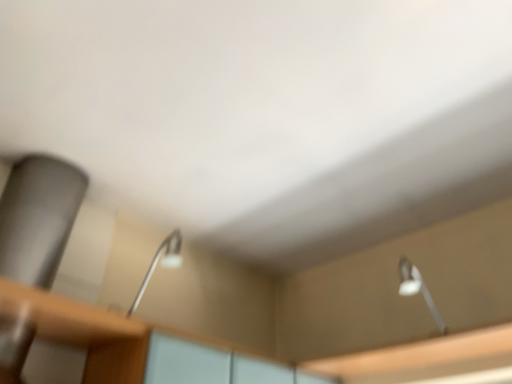
Question: Is the surface of white glossy lamp at upper right, arranged as the first lamp when viewed from the right, in direct contact with wooden table at lower left?

Choices:
 (A) yes
 (B) no

Answer: (B)

Question: Is white glossy lamp at upper right, positioned as the second lamp in left-to-right order, not inside wooden table at lower left?

Choices:
 (A) yes
 (B) no

Answer: (A)

Question: Does white glossy lamp at upper right, arranged as the first lamp when viewed from the right, have a greater height compared to wooden table at lower left?

Choices:
 (A) no
 (B) yes

Answer: (B)

Question: From the image's perspective, does white glossy lamp at upper right, arranged as the first lamp when viewed from the right, appear higher than wooden table at lower left?

Choices:
 (A) no
 (B) yes

Answer: (B)

Question: Considering the relative sizes of white glossy lamp at upper right, positioned as the second lamp in left-to-right order, and wooden table at lower left in the image provided, is white glossy lamp at upper right, positioned as the second lamp in left-to-right order, shorter than wooden table at lower left?

Choices:
 (A) yes
 (B) no

Answer: (B)

Question: In terms of height, does wooden table at lower left look taller or shorter compared to metallic silver lamp at center, which is counted as the 1th lamp, starting from the left?

Choices:
 (A) short
 (B) tall

Answer: (A)

Question: Is point (61, 334) positioned closer to the camera than point (152, 261)?

Choices:
 (A) closer
 (B) farther

Answer: (A)

Question: From the image's perspective, is wooden table at lower left positioned above or below metallic silver lamp at center, positioned as the 2th lamp in right-to-left order?

Choices:
 (A) above
 (B) below

Answer: (B)

Question: Is wooden table at lower left bigger or smaller than metallic silver lamp at center, which is counted as the 1th lamp, starting from the left?

Choices:
 (A) big
 (B) small

Answer: (A)

Question: In terms of width, does metallic silver lamp at center, positioned as the 2th lamp in right-to-left order, look wider or thinner when compared to white glossy lamp at upper right, positioned as the second lamp in left-to-right order?

Choices:
 (A) wide
 (B) thin

Answer: (A)

Question: From the image's perspective, relative to white glossy lamp at upper right, arranged as the first lamp when viewed from the right, is metallic silver lamp at center, which is counted as the 1th lamp, starting from the left, above or below?

Choices:
 (A) below
 (B) above

Answer: (B)

Question: From a real-world perspective, is metallic silver lamp at center, positioned as the 2th lamp in right-to-left order, physically located above or below white glossy lamp at upper right, arranged as the first lamp when viewed from the right?

Choices:
 (A) below
 (B) above

Answer: (B)

Question: Considering their positions, is metallic silver lamp at center, which is counted as the 1th lamp, starting from the left, located in front of or behind white glossy lamp at upper right, positioned as the second lamp in left-to-right order?

Choices:
 (A) behind
 (B) front

Answer: (B)

Question: From the image's perspective, is white glossy lamp at upper right, arranged as the first lamp when viewed from the right, located above or below metallic silver lamp at center, positioned as the 2th lamp in right-to-left order?

Choices:
 (A) above
 (B) below

Answer: (B)

Question: In terms of height, does white glossy lamp at upper right, arranged as the first lamp when viewed from the right, look taller or shorter compared to metallic silver lamp at center, which is counted as the 1th lamp, starting from the left?

Choices:
 (A) short
 (B) tall

Answer: (A)